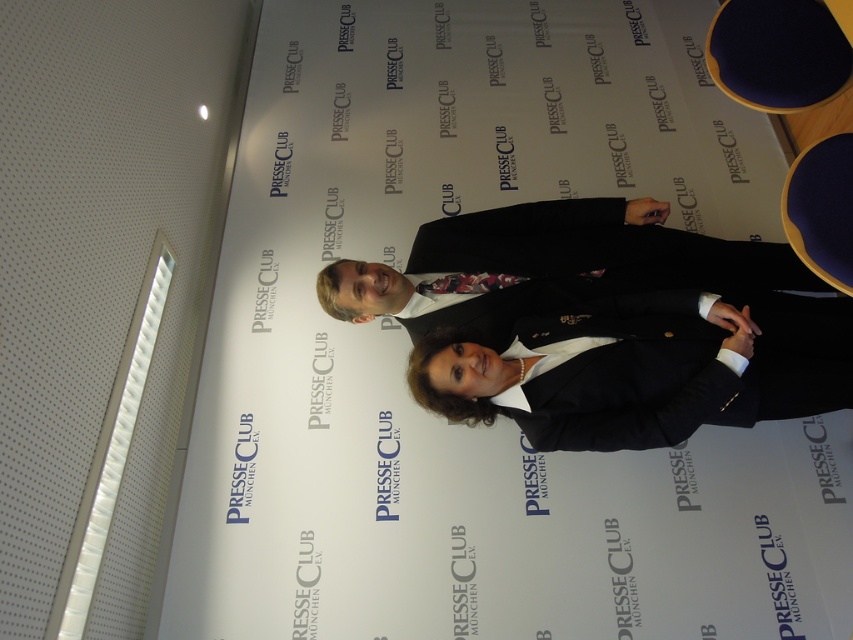
Which is below, dark suit at center or floral silk tie at center?

floral silk tie at center is lower down.

Is dark suit at center thinner than floral silk tie at center?

Incorrect, dark suit at center's width is not less than floral silk tie at center's.

Is point (764, 280) behind point (489, 282)?

Yes, it is.

Locate an element on the screen. The height and width of the screenshot is (640, 853). dark suit at center is located at coordinates (556, 266).

Between black satin blazer at center and floral silk tie at center, which one appears on the left side from the viewer's perspective?

From the viewer's perspective, floral silk tie at center appears more on the left side.

Can you confirm if black satin blazer at center is positioned to the left of floral silk tie at center?

No, black satin blazer at center is not to the left of floral silk tie at center.

Between point (788, 371) and point (525, 278), which one is positioned behind?

The point (525, 278) is more distant.

Find the location of `black satin blazer at center`. black satin blazer at center is located at coordinates (643, 368).

Consider the image. Can you confirm if black satin blazer at center is shorter than dark suit at center?

Yes, black satin blazer at center is shorter than dark suit at center.

What do you see at coordinates (643, 368) in the screenshot?
I see `black satin blazer at center` at bounding box center [643, 368].

Is point (758, 419) farther from viewer compared to point (717, 244)?

No, it is not.

I want to click on black satin blazer at center, so (x=643, y=368).